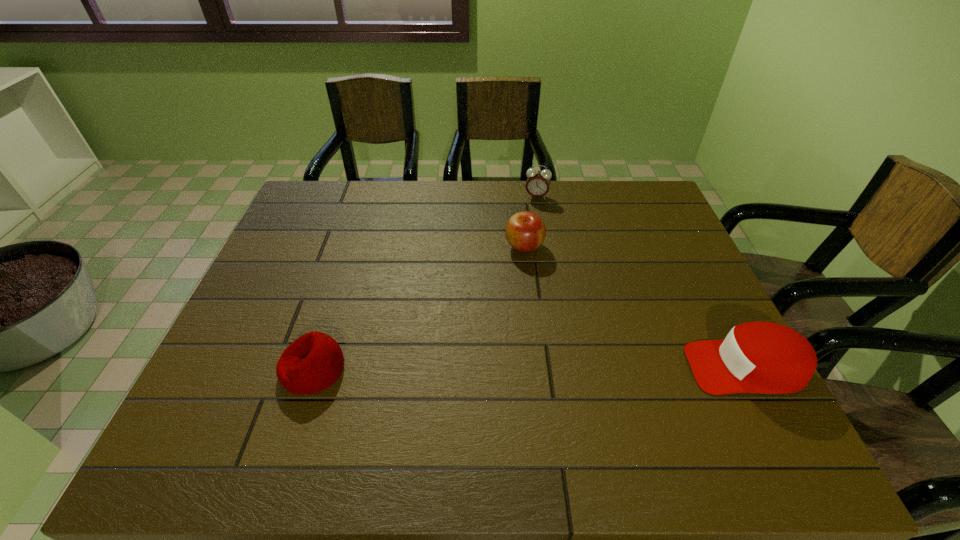
In order to click on the shortest object in this screenshot , I will do `click(313, 362)`.

The height and width of the screenshot is (540, 960). Find the location of `beanbag`. beanbag is located at coordinates (313, 362).

The width and height of the screenshot is (960, 540). I want to click on baseball cap, so click(755, 357).

Identify the location of the second farthest object. The height and width of the screenshot is (540, 960). (525, 231).

The image size is (960, 540). Identify the location of the farthest object. (538, 182).

Where is `free space located 0.050m on the seat area of the leftmost object`? free space located 0.050m on the seat area of the leftmost object is located at coordinates (259, 369).

This screenshot has height=540, width=960. Identify the location of blank space located 0.150m on the seat area of the leftmost object. (214, 369).

Where is `free space located on the front-facing side of the rightmost object`? free space located on the front-facing side of the rightmost object is located at coordinates (527, 367).

Identify the location of free space located on the front-facing side of the rightmost object. This screenshot has width=960, height=540. (648, 367).

The image size is (960, 540). I want to click on free space located 0.230m on the front-facing side of the rightmost object, so click(x=586, y=367).